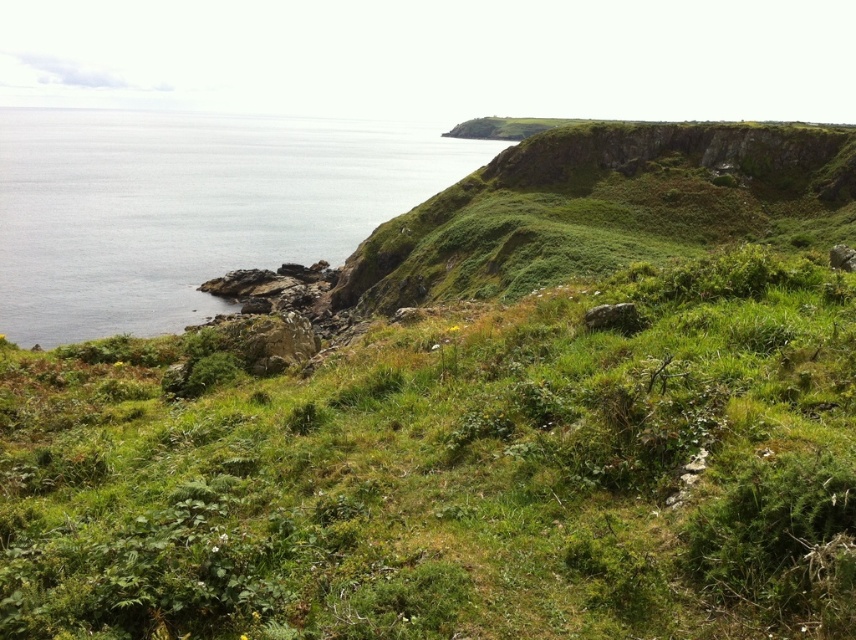
Question: Which object is farther from the camera taking this photo?

Choices:
 (A) green grassy at center
 (B) clear blue water at left

Answer: (B)

Question: Is green grassy at center further to camera compared to clear blue water at left?

Choices:
 (A) no
 (B) yes

Answer: (A)

Question: Is green grassy at center behind clear blue water at left?

Choices:
 (A) yes
 (B) no

Answer: (B)

Question: Is green grassy at center behind clear blue water at left?

Choices:
 (A) no
 (B) yes

Answer: (A)